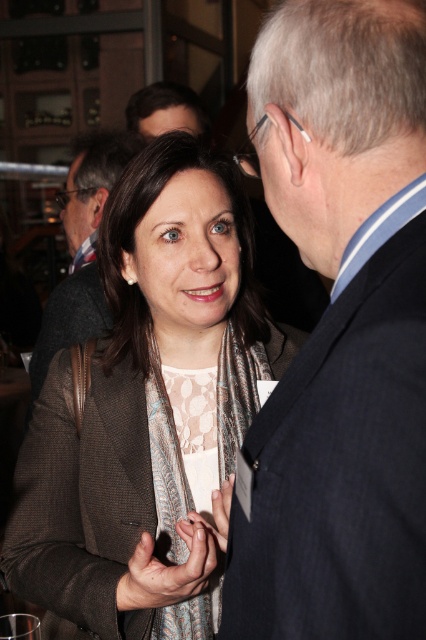
You are a photographer at the event and need to ensure the brown textured blazer at center is visible in the photo. Given that the camera focuses on the point at coordinates point (146, 404), will the blazer be in focus?

The brown textured blazer at center is located exactly at point (146, 404), so yes, the blazer will be in focus as the camera is focused on that point.

You are a photographer at a formal event. You want to capture a closeup shot of the brown textured blazer at center and the smooth skin hand at center in the same frame. Given that your camera has a depth of field that can focus on objects within 8 inches, will both objects be in focus?

The brown textured blazer at center is 8.62 inches from smooth skin hand at center. Since the distance between them exceeds the camera sensor depth of field range of 8 inches, the two objects will not both be in focus in the same shot.

You are organizing a charity event and need to place both the dark blue suit at center and the transparent glass at upper center on a table. The table has limited space. Which object should you place first to ensure both fit comfortably?

The transparent glass at upper center is smaller than the dark blue suit at center, so you should place the dark blue suit at center first to accommodate its larger size, then fit the transparent glass at upper center around it.